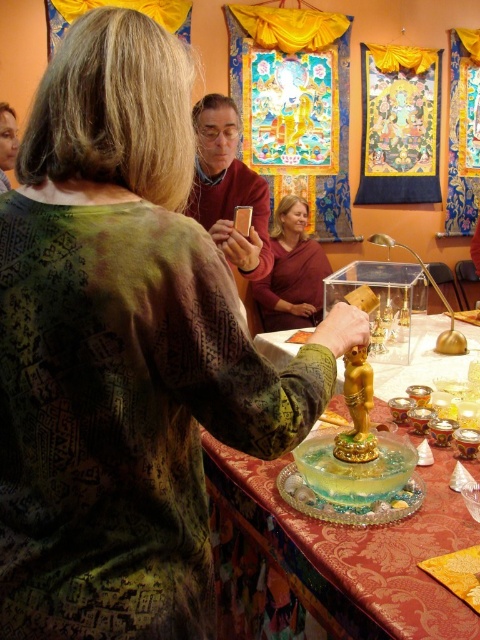
Who is higher up, translucent glass statue at center or matte brown statue at center?

matte brown statue at center is higher up.

Is the position of translucent glass statue at center less distant than that of matte brown statue at center?

Yes.

Between point (432, 360) and point (284, 291), which one is positioned behind?

The point (284, 291) is behind.

The height and width of the screenshot is (640, 480). What are the coordinates of `translucent glass statue at center` in the screenshot? It's located at (376, 548).

Who is more distant from viewer, (x=324, y=272) or (x=376, y=492)?

Positioned behind is point (x=324, y=272).

Is matte brown statue at center wider than translucent gelatinous cake at center?

Yes.

Is point (289, 301) farther from camera compared to point (333, 486)?

Yes, point (289, 301) is behind point (333, 486).

The image size is (480, 640). In order to click on matte brown statue at center in this screenshot , I will do `click(291, 273)`.

Does translucent glass statue at center appear on the left side of translucent gelatinous cake at center?

Incorrect, translucent glass statue at center is not on the left side of translucent gelatinous cake at center.

Which is behind, point (441, 364) or point (385, 444)?

The point (441, 364) is behind.

You are a GUI agent. You are given a task and a screenshot of the screen. Output one action in this format:
    pyautogui.click(x=<x>, y=<y>)
    Task: Click on the translucent glass statue at center
    This screenshot has width=480, height=640.
    Given the screenshot: What is the action you would take?
    pyautogui.click(x=376, y=548)